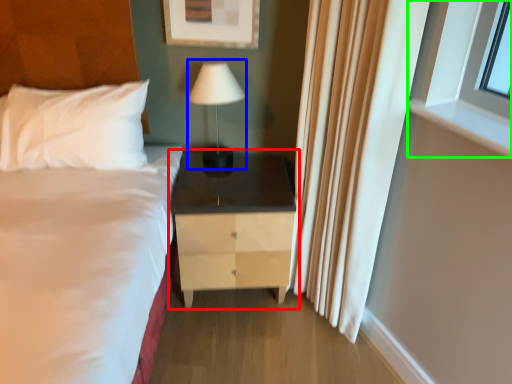
Question: Based on their relative distances, which object is nearer to nightstand (highlighted by a red box)? Choose from table lamp (highlighted by a blue box) and window (highlighted by a green box).

Choices:
 (A) table lamp
 (B) window

Answer: (A)